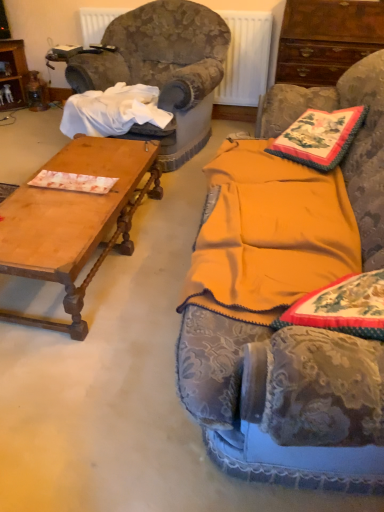
Question: Is metallic radiator at upper center surrounding mahogany wood cabinet at upper right?

Choices:
 (A) yes
 (B) no

Answer: (B)

Question: Is metallic radiator at upper center wider than mahogany wood cabinet at upper right?

Choices:
 (A) yes
 (B) no

Answer: (B)

Question: Can you confirm if metallic radiator at upper center is bigger than mahogany wood cabinet at upper right?

Choices:
 (A) no
 (B) yes

Answer: (A)

Question: From the image's perspective, does metallic radiator at upper center appear higher than mahogany wood cabinet at upper right?

Choices:
 (A) no
 (B) yes

Answer: (B)

Question: Does metallic radiator at upper center appear on the right side of mahogany wood cabinet at upper right?

Choices:
 (A) no
 (B) yes

Answer: (A)

Question: Is wooden polished coffee table at left inside or outside of velvet fabric couch at center?

Choices:
 (A) outside
 (B) inside

Answer: (A)

Question: Would you say wooden polished coffee table at left is to the left or to the right of velvet fabric couch at center in the picture?

Choices:
 (A) left
 (B) right

Answer: (A)

Question: In terms of width, does wooden polished coffee table at left look wider or thinner when compared to velvet fabric couch at center?

Choices:
 (A) thin
 (B) wide

Answer: (A)

Question: Based on their sizes in the image, would you say wooden polished coffee table at left is bigger or smaller than velvet fabric couch at center?

Choices:
 (A) small
 (B) big

Answer: (A)

Question: Do you think embroidered fabric pillow at upper right is within velvet-like fabric armchair at left, or outside of it?

Choices:
 (A) inside
 (B) outside

Answer: (B)

Question: Is embroidered fabric pillow at upper right in front of or behind velvet-like fabric armchair at left in the image?

Choices:
 (A) front
 (B) behind

Answer: (A)

Question: Considering the positions of embroidered fabric pillow at upper right and velvet-like fabric armchair at left in the image, is embroidered fabric pillow at upper right taller or shorter than velvet-like fabric armchair at left?

Choices:
 (A) tall
 (B) short

Answer: (B)

Question: Based on their positions, is embroidered fabric pillow at upper right located to the left or right of velvet-like fabric armchair at left?

Choices:
 (A) left
 (B) right

Answer: (B)

Question: Visually, is velvet-like fabric armchair at left positioned to the left or to the right of wooden polished coffee table at left?

Choices:
 (A) left
 (B) right

Answer: (B)

Question: Relative to wooden polished coffee table at left, is velvet-like fabric armchair at left in front or behind?

Choices:
 (A) front
 (B) behind

Answer: (B)